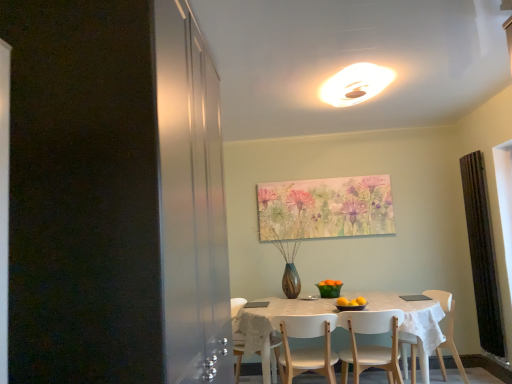
Question: Considering the relative sizes of white glossy light fixture at upper center and black textured curtain at right in the image provided, is white glossy light fixture at upper center shorter than black textured curtain at right?

Choices:
 (A) no
 (B) yes

Answer: (B)

Question: Does white glossy light fixture at upper center have a smaller size compared to black textured curtain at right?

Choices:
 (A) no
 (B) yes

Answer: (B)

Question: Considering the relative positions of white glossy light fixture at upper center and black textured curtain at right in the image provided, is white glossy light fixture at upper center to the right of black textured curtain at right from the viewer's perspective?

Choices:
 (A) no
 (B) yes

Answer: (A)

Question: Is white glossy light fixture at upper center to the left of black textured curtain at right from the viewer's perspective?

Choices:
 (A) no
 (B) yes

Answer: (B)

Question: Is white glossy light fixture at upper center located outside black textured curtain at right?

Choices:
 (A) yes
 (B) no

Answer: (A)

Question: From a real-world perspective, is black textured curtain at right positioned above or below white matte chair at lower center, which appears as the 2th chair when viewed from the right?

Choices:
 (A) above
 (B) below

Answer: (A)

Question: Relative to white matte chair at lower center, marked as the 2th chair in a left-to-right arrangement, is black textured curtain at right in front or behind?

Choices:
 (A) behind
 (B) front

Answer: (A)

Question: From the image's perspective, is black textured curtain at right above or below white matte chair at lower center, marked as the 2th chair in a left-to-right arrangement?

Choices:
 (A) below
 (B) above

Answer: (B)

Question: Does point (503, 331) appear closer or farther from the camera than point (358, 314)?

Choices:
 (A) farther
 (B) closer

Answer: (A)

Question: From a real-world perspective, relative to white wood chair at center, which appears as the 1th chair when viewed from the left, is white matte chair at lower right, acting as the 1th chair starting from the right, vertically above or below?

Choices:
 (A) below
 (B) above

Answer: (A)

Question: From the image's perspective, is white matte chair at lower right, acting as the third chair starting from the left, above or below white wood chair at center, which appears as the 1th chair when viewed from the left?

Choices:
 (A) below
 (B) above

Answer: (A)

Question: Is white matte chair at lower right, acting as the third chair starting from the left, bigger or smaller than white wood chair at center, the 3th chair in the right-to-left sequence?

Choices:
 (A) big
 (B) small

Answer: (A)

Question: Based on their positions, is white matte chair at lower right, acting as the third chair starting from the left, located to the left or right of white wood chair at center, which appears as the 1th chair when viewed from the left?

Choices:
 (A) left
 (B) right

Answer: (B)

Question: Is white matte chair at lower center, marked as the 2th chair in a left-to-right arrangement, inside or outside of black textured curtain at right?

Choices:
 (A) outside
 (B) inside

Answer: (A)

Question: Considering the positions of white matte chair at lower center, which appears as the 2th chair when viewed from the right, and black textured curtain at right in the image, is white matte chair at lower center, which appears as the 2th chair when viewed from the right, wider or thinner than black textured curtain at right?

Choices:
 (A) wide
 (B) thin

Answer: (A)